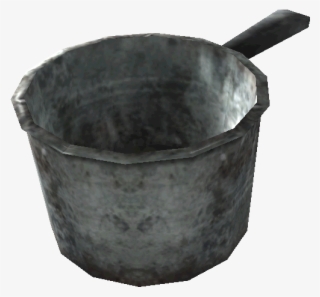
Find the location of a particular element. The image size is (320, 297). object handle is located at coordinates (255, 38).